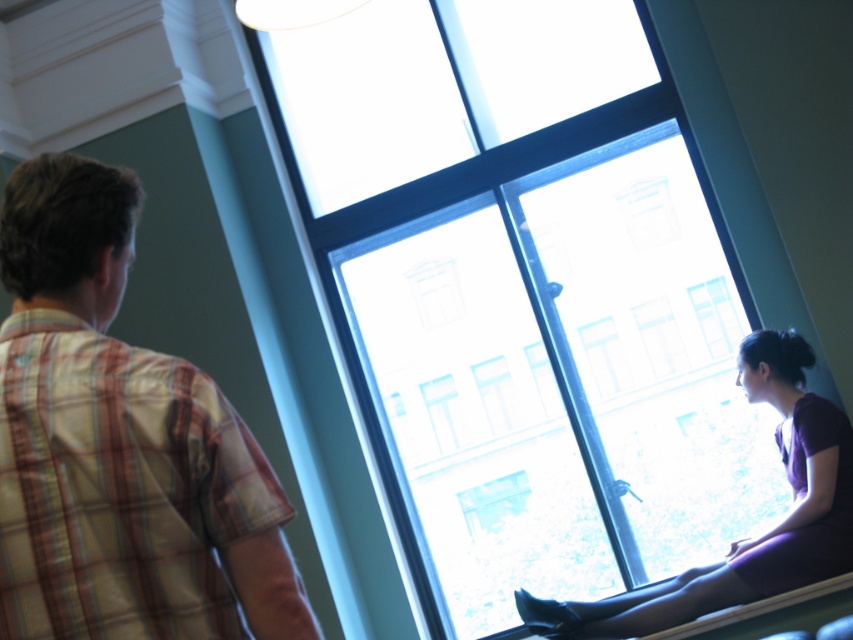
Question: Which of the following is the closest to the observer?

Choices:
 (A) (3, 547)
 (B) (250, 51)
 (C) (772, 540)

Answer: (A)

Question: Is plaid cotton shirt at left to the right of matte purple dress at window from the viewer's perspective?

Choices:
 (A) yes
 (B) no

Answer: (B)

Question: Does plaid cotton shirt at left appear on the left side of matte purple dress at window?

Choices:
 (A) yes
 (B) no

Answer: (A)

Question: Which object appears farthest from the camera in this image?

Choices:
 (A) plaid cotton shirt at left
 (B) matte purple dress at window

Answer: (B)

Question: Is transparent glass window at center behind plaid cotton shirt at left?

Choices:
 (A) yes
 (B) no

Answer: (A)

Question: Which of the following is the closest to the observer?

Choices:
 (A) (610, 484)
 (B) (160, 637)

Answer: (B)